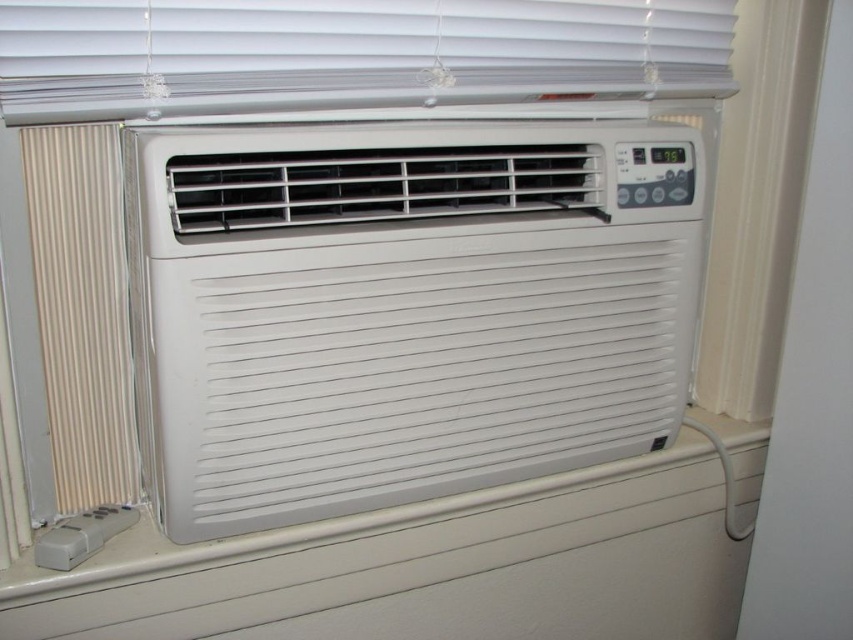
You are trying to adjust the temperature in the room using the remote control for the AC unit. However, you notice another heating device nearby. Which object is taller, the metallic silver radiator at left or the white plastic thermostat at center?

The metallic silver radiator at left is much taller than the white plastic thermostat at center.

You are a technician checking the heating system in a room with a window AC unit. You need to adjust the temperature using either the metallic silver radiator at left or the white plastic thermostat at center. Which device should you use for adjusting the room temperature?

You should use the white plastic thermostat at center to adjust the room temperature because it is the control device for the AC unit, while the metallic silver radiator at left is likely part of a separate heating system and is larger in size.

You are a technician who needs to replace the white plastic air conditioner at center and the metallic silver radiator at left. The new unit requires a minimum of 10 inches of clearance between them for installation. Based on the current spacing, can you install the new unit without moving either appliance?

The white plastic air conditioner at center and the metallic silver radiator at left are currently 9.90 inches apart, which is less than the required 10 inches of clearance. Therefore, you cannot install the new unit without moving either appliance.